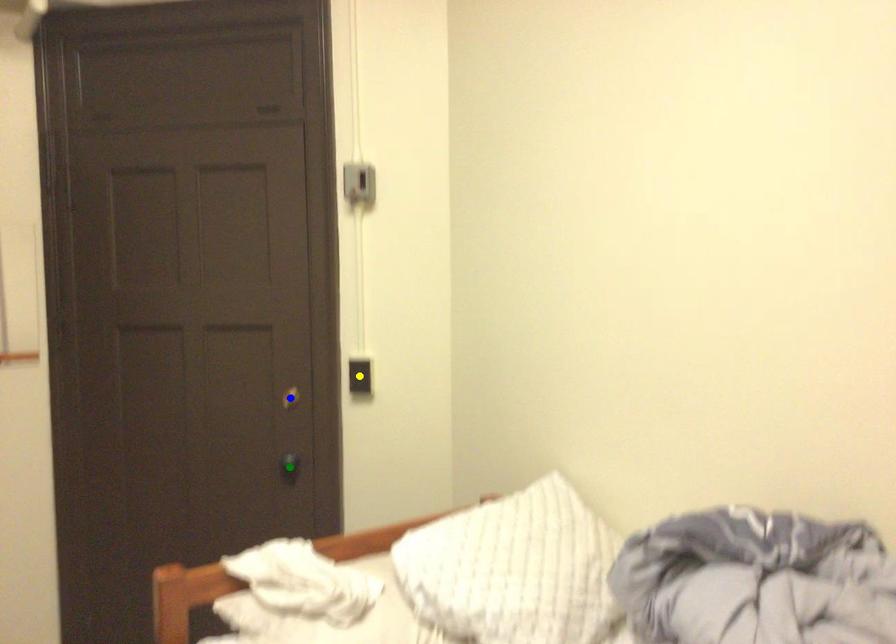
Order these from farthest to nearest:
1. green point
2. yellow point
3. blue point

blue point → green point → yellow point